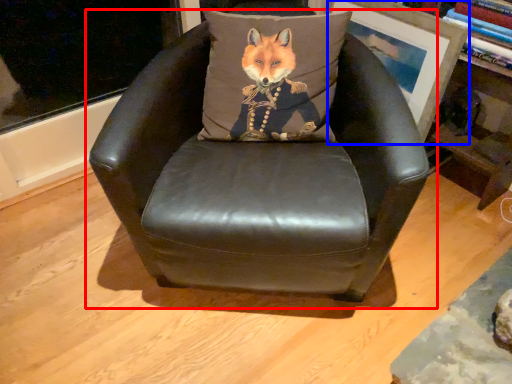
Question: Which object is further to the camera taking this photo, chair (highlighted by a red box) or picture frame (highlighted by a blue box)?

Choices:
 (A) chair
 (B) picture frame

Answer: (B)